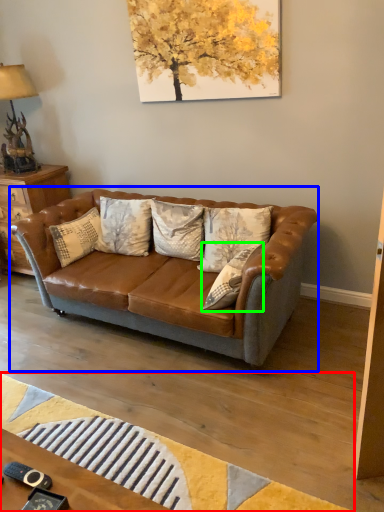
Question: Which object is the farthest from mat (highlighted by a red box)? Choose among these: studio couch (highlighted by a blue box) or pillow (highlighted by a green box).

Choices:
 (A) studio couch
 (B) pillow

Answer: (B)